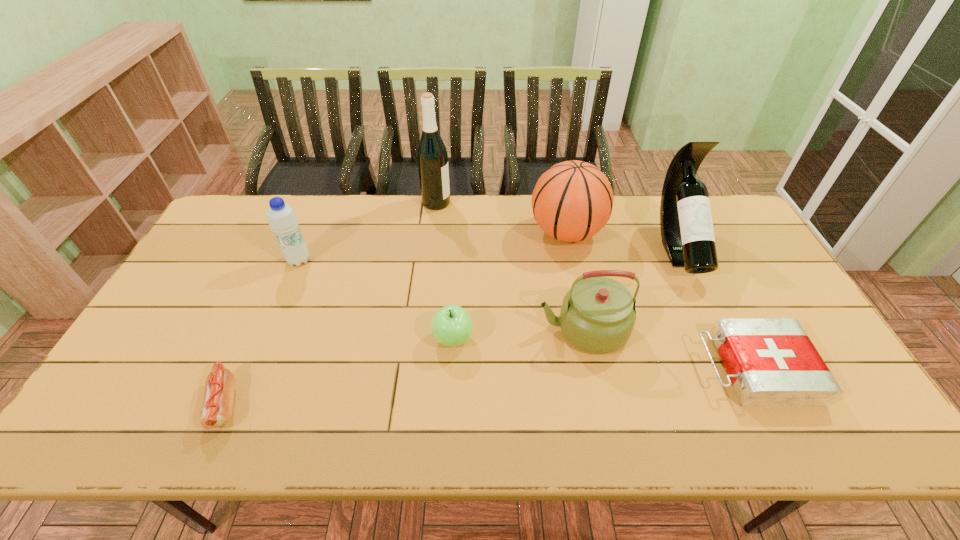
The height and width of the screenshot is (540, 960). What are the coordinates of `vacant area at the right edge` in the screenshot? It's located at (745, 264).

At what (x,y) coordinates should I click in order to perform the action: click on vacant space at the far left corner of the desktop. Please return your answer as a coordinate pair (x, y). Looking at the image, I should click on (241, 203).

The image size is (960, 540). In the image, there is a desktop. Find the location of `vacant space at the near left corner`. vacant space at the near left corner is located at coordinates (123, 419).

At what (x,y) coordinates should I click in order to perform the action: click on vacant area between the first-aid kit and the basketball. Please return your answer as a coordinate pair (x, y). Looking at the image, I should click on (660, 301).

You are a GUI agent. You are given a task and a screenshot of the screen. Output one action in this format:
    pyautogui.click(x=<x>, y=<y>)
    Task: Click on the vacant point located between the basketball and the second tallest object
    The image size is (960, 540).
    Given the screenshot: What is the action you would take?
    pyautogui.click(x=622, y=240)

Where is `free space between the taller wine bottle and the apple`? free space between the taller wine bottle and the apple is located at coordinates (444, 271).

At what (x,y) coordinates should I click in order to perform the action: click on blank region between the farther wine bottle and the water bottle. Please return your answer as a coordinate pair (x, y). The height and width of the screenshot is (540, 960). Looking at the image, I should click on (368, 232).

The image size is (960, 540). I want to click on unoccupied area between the basketball and the kettle, so click(574, 281).

This screenshot has height=540, width=960. In order to click on empty space between the kettle and the tallest object in this screenshot , I will do `click(510, 266)`.

At what (x,y) coordinates should I click in order to perform the action: click on free space between the right wine bottle and the kettle. Please return your answer as a coordinate pair (x, y). The width and height of the screenshot is (960, 540). Looking at the image, I should click on (630, 288).